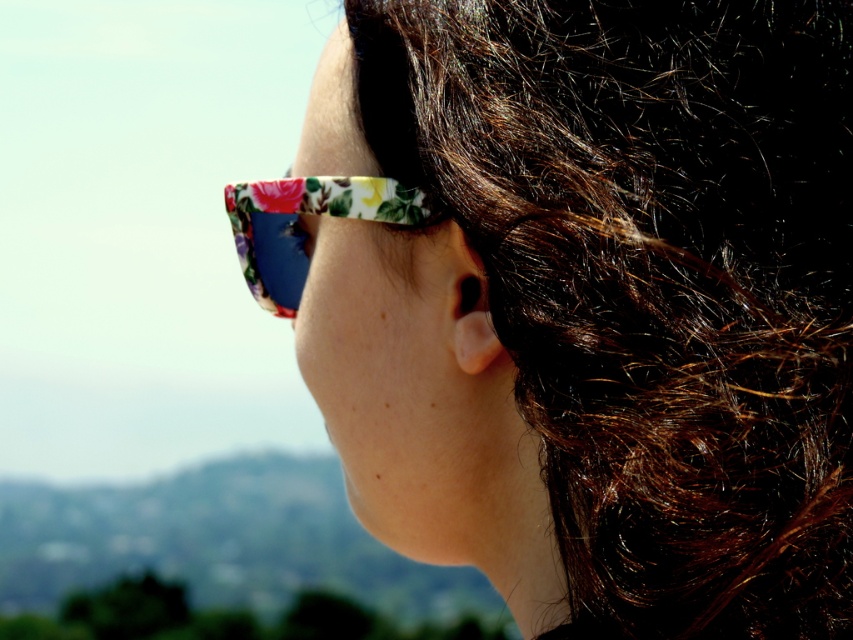
Question: Does floral acetate sunglasses at center lie behind floral-patterned plastic sunglasses at center?

Choices:
 (A) yes
 (B) no

Answer: (B)

Question: Which of the following is the farthest from the observer?

Choices:
 (A) floral acetate sunglasses at center
 (B) floral-patterned plastic sunglasses at center

Answer: (B)

Question: Where is floral acetate sunglasses at center located in relation to floral-patterned plastic sunglasses at center in the image?

Choices:
 (A) below
 (B) above

Answer: (A)

Question: In this image, where is floral acetate sunglasses at center located relative to floral-patterned plastic sunglasses at center?

Choices:
 (A) left
 (B) right

Answer: (B)

Question: Which object is farther from the camera taking this photo?

Choices:
 (A) floral acetate sunglasses at center
 (B) floral-patterned plastic sunglasses at center

Answer: (B)